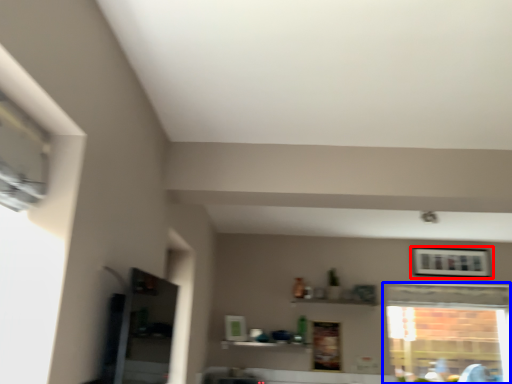
Question: Which object appears farthest to the camera in this image, picture frame (highlighted by a red box) or window (highlighted by a blue box)?

Choices:
 (A) picture frame
 (B) window

Answer: (A)